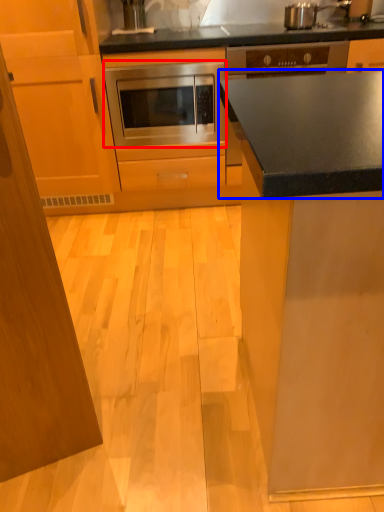
Question: Which of the following is the farthest to the observer, oven (highlighted by a red box) or countertop (highlighted by a blue box)?

Choices:
 (A) oven
 (B) countertop

Answer: (A)